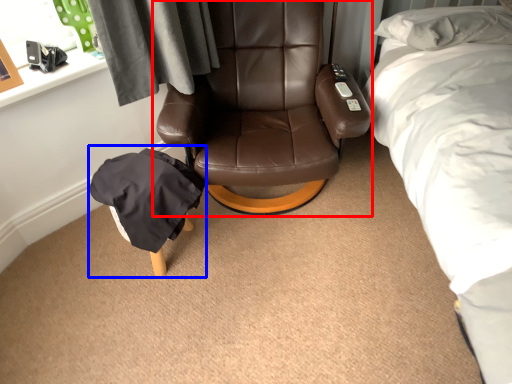
Question: Which of the following is the farthest to the observer, chair (highlighted by a red box) or bean bag chair (highlighted by a blue box)?

Choices:
 (A) chair
 (B) bean bag chair

Answer: (B)